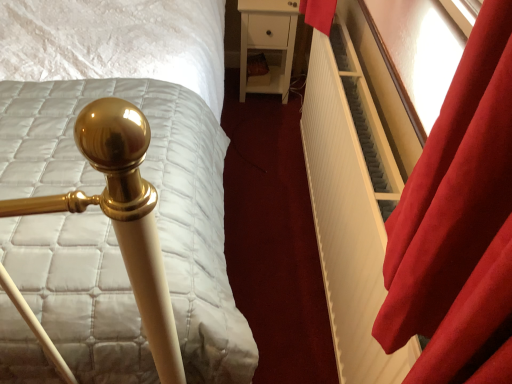
Question: In the image, is white ribbed radiator at right positioned in front of or behind white matte nightstand at center?

Choices:
 (A) behind
 (B) front

Answer: (B)

Question: From their relative heights in the image, would you say white ribbed radiator at right is taller or shorter than white matte nightstand at center?

Choices:
 (A) short
 (B) tall

Answer: (B)

Question: Which object is positioned farthest from the white matte nightstand at center?

Choices:
 (A) gold polished bedpost at left
 (B) velvet red curtain at right
 (C) white ribbed radiator at right

Answer: (B)

Question: Which of these objects is positioned closest to the white ribbed radiator at right?

Choices:
 (A) gold polished bedpost at left
 (B) white matte nightstand at center
 (C) velvet red curtain at right

Answer: (C)